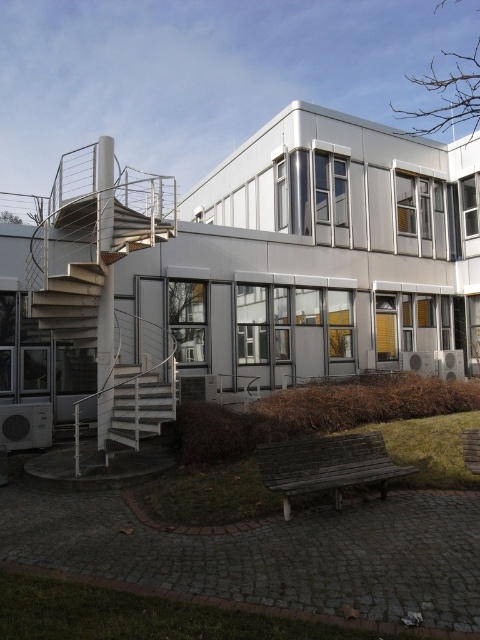
You are standing on the grassy area near the dry shrubs and want to approach the white metallic staircase at left and the white metallic staircase at lower left. Which staircase should you head towards if you want to reach the one closer to the building?

The white metallic staircase at lower left is closer to the building because it is positioned lower than the white metallic staircase at left, which is further away from the building.

You are standing at the entrance of the building and see the white metallic staircase at left and the white metallic staircase at lower left. Which staircase is closer to you?

Both staircases are the same because they are the same staircase. The description mentions they are 6.20 feet away from each other, but since they are parts of the same structure, their distance is irrelevant. However, according to the given information, the white metallic staircase at left is 6.20 feet away from the white metallic staircase at lower left, implying they are separate entities. Therefore, without additional context on their positions relative to the entrance, it is impossible to determine.